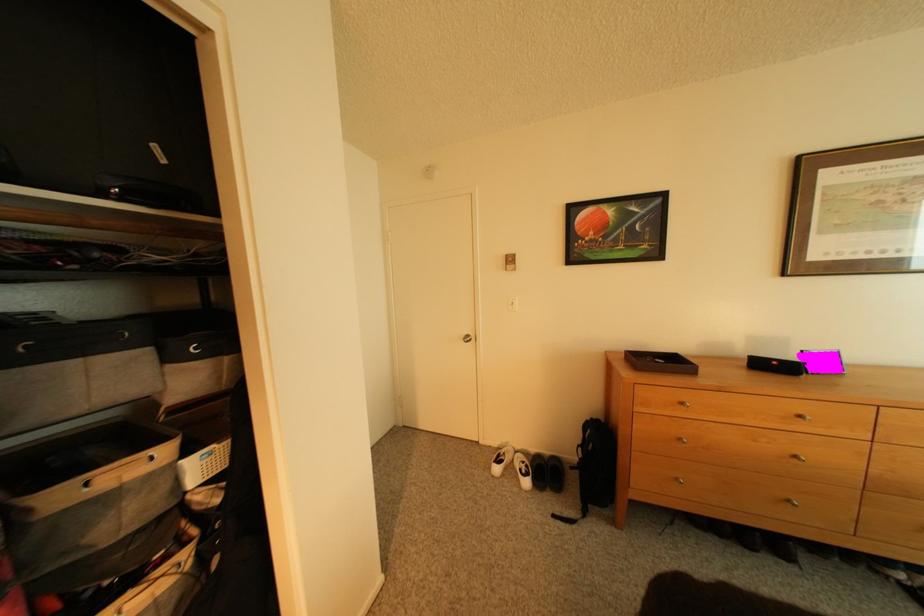
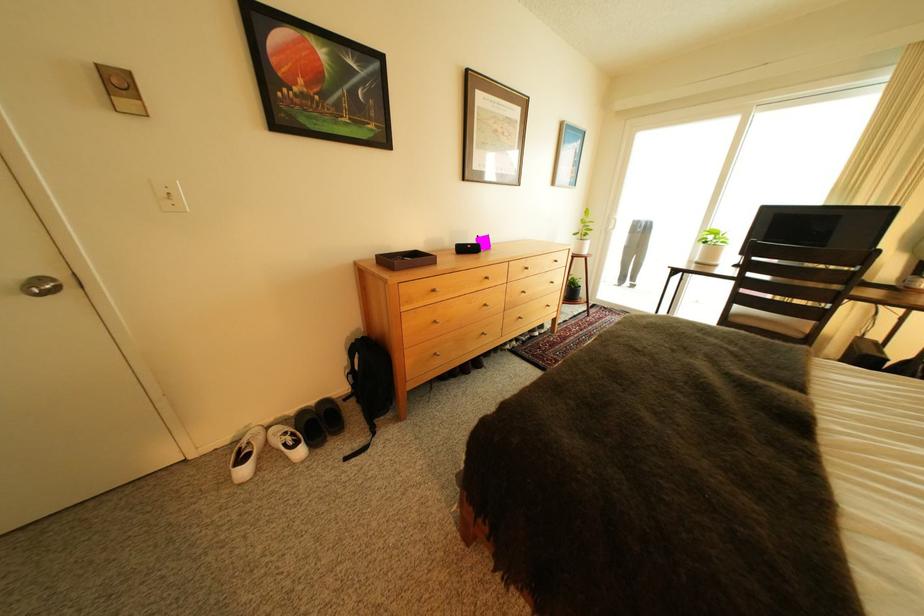
Locate, in the second image, the point that corresponds to (533,466) in the first image.

(296, 439)